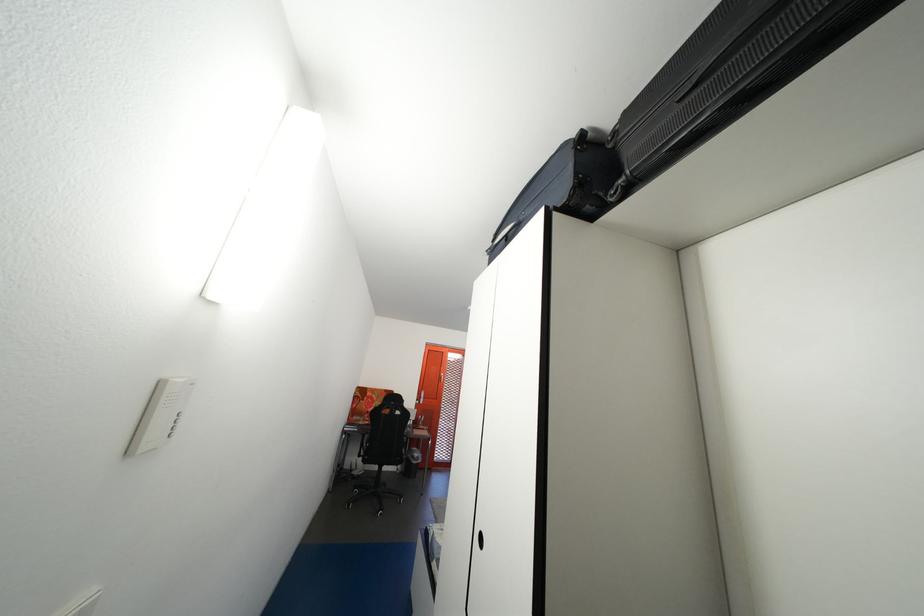
The image size is (924, 616). In order to click on black chair armrest in this screenshot , I will do `click(351, 439)`.